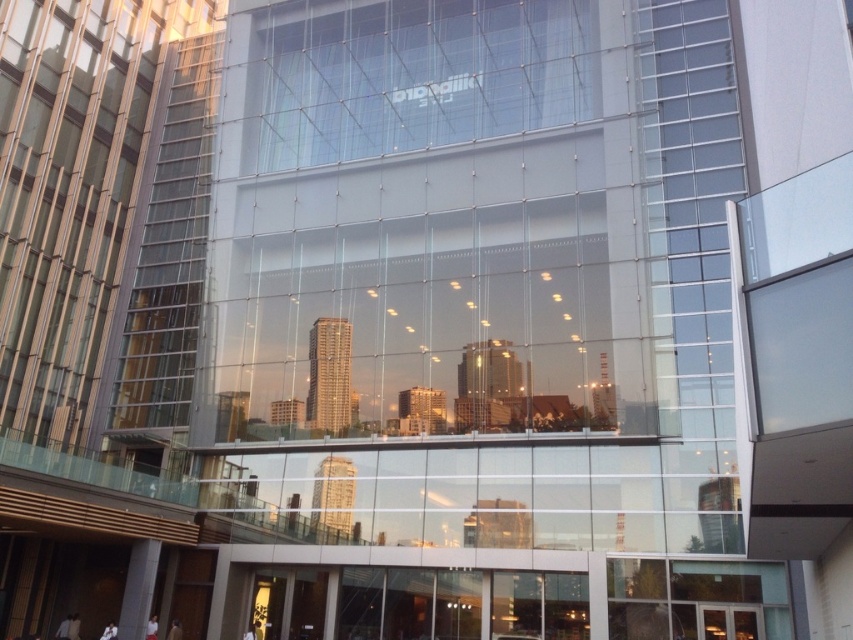
You are an architect reviewing the design of the transparent glass building at center and the transparent glass window at center. Which one is taller?

The transparent glass building at center is taller than the transparent glass window at center.

You are an architect evaluating the modern glass building. You need to determine which of the two transparent structures, the transparent glass building at center or the transparent glass window at center, has a smaller width when viewed from the front. Which one is narrower?

The transparent glass building at center is thinner than the transparent glass window at center, so the transparent glass building at center is narrower.